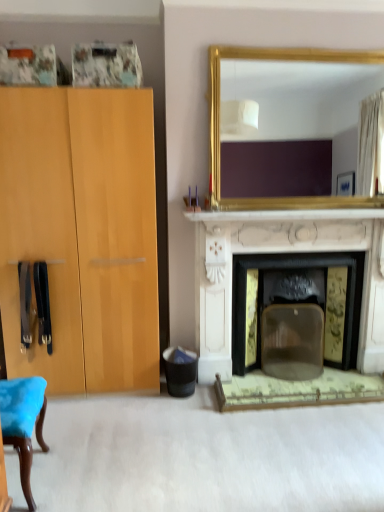
Question: Does black plastic trash bin at lower center have a lesser height compared to white marble fireplace at center?

Choices:
 (A) no
 (B) yes

Answer: (B)

Question: Is black plastic trash bin at lower center smaller than white marble fireplace at center?

Choices:
 (A) no
 (B) yes

Answer: (B)

Question: Can white marble fireplace at center be found inside black plastic trash bin at lower center?

Choices:
 (A) yes
 (B) no

Answer: (B)

Question: Is white marble fireplace at center at the back of black plastic trash bin at lower center?

Choices:
 (A) yes
 (B) no

Answer: (B)

Question: Is the depth of black plastic trash bin at lower center greater than that of white marble fireplace at center?

Choices:
 (A) yes
 (B) no

Answer: (A)

Question: Relative to gold-framed mirror at upper center, is white marble fireplace at center in front or behind?

Choices:
 (A) front
 (B) behind

Answer: (B)

Question: Is white marble fireplace at center inside the boundaries of gold-framed mirror at upper center, or outside?

Choices:
 (A) outside
 (B) inside

Answer: (A)

Question: Considering the relative positions of white marble fireplace at center and gold-framed mirror at upper center in the image provided, is white marble fireplace at center to the left or to the right of gold-framed mirror at upper center?

Choices:
 (A) left
 (B) right

Answer: (A)

Question: From a real-world perspective, is white marble fireplace at center above or below gold-framed mirror at upper center?

Choices:
 (A) below
 (B) above

Answer: (A)

Question: Is gold-framed mirror at upper center taller or shorter than black plastic trash bin at lower center?

Choices:
 (A) tall
 (B) short

Answer: (A)

Question: Visually, is gold-framed mirror at upper center positioned to the left or to the right of black plastic trash bin at lower center?

Choices:
 (A) right
 (B) left

Answer: (A)

Question: Is point (304, 204) closer or farther from the camera than point (195, 370)?

Choices:
 (A) closer
 (B) farther

Answer: (A)

Question: From a real-world perspective, is gold-framed mirror at upper center positioned above or below black plastic trash bin at lower center?

Choices:
 (A) below
 (B) above

Answer: (B)

Question: From the image's perspective, is gold-framed mirror at upper center located above or below white marble fireplace at center?

Choices:
 (A) below
 (B) above

Answer: (B)

Question: In terms of height, does gold-framed mirror at upper center look taller or shorter compared to white marble fireplace at center?

Choices:
 (A) tall
 (B) short

Answer: (B)